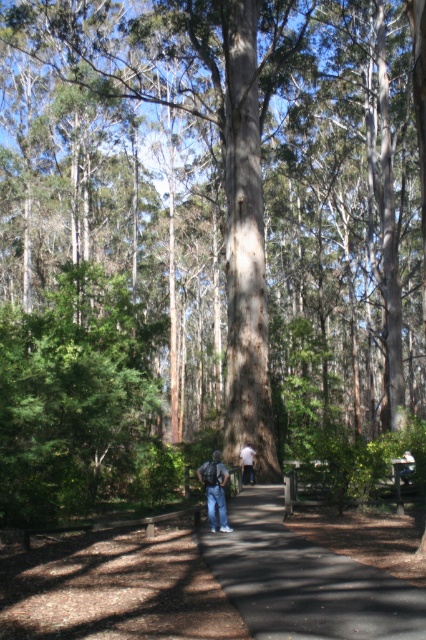
Can you confirm if denim jeans at center is positioned below white cotton shirt at center?

Incorrect, denim jeans at center is not positioned below white cotton shirt at center.

Who is shorter, denim jeans at center or white cotton shirt at center?

white cotton shirt at center

Is point (221, 490) farther from viewer compared to point (247, 476)?

No.

The height and width of the screenshot is (640, 426). Find the location of `denim jeans at center`. denim jeans at center is located at coordinates (215, 490).

Which is in front, point (256, 593) or point (250, 483)?

Point (256, 593)

Does dark brown asphalt at center have a lesser height compared to white cotton shirt at center?

No.

Image resolution: width=426 pixels, height=640 pixels. In order to click on dark brown asphalt at center in this screenshot , I will do `click(304, 579)`.

Who is higher up, dark brown asphalt at center or denim jeans at center?

denim jeans at center is above.

Image resolution: width=426 pixels, height=640 pixels. I want to click on dark brown asphalt at center, so click(x=304, y=579).